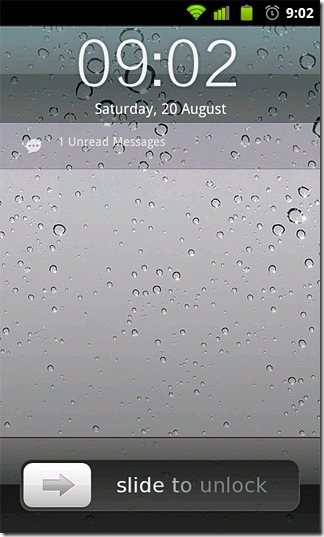
Identify the location of bar. (143, 498).